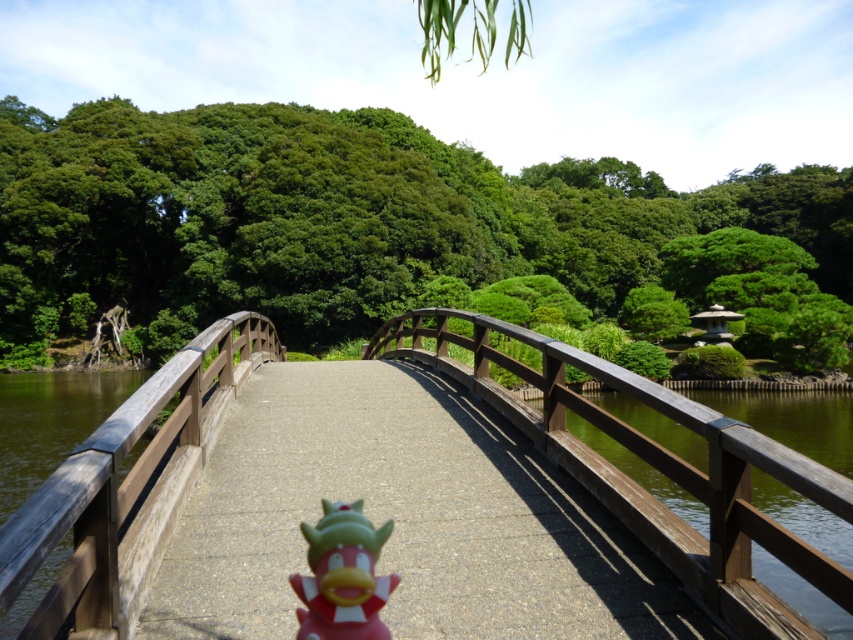
Question: Among these points, which one is farthest from the camera?

Choices:
 (A) (207, 396)
 (B) (372, 616)
 (C) (672, 552)

Answer: (A)

Question: Can you confirm if wooden bridge at center is positioned below wooden rail at center?

Choices:
 (A) yes
 (B) no

Answer: (B)

Question: Which object appears closest to the camera in this image?

Choices:
 (A) wooden rail at center
 (B) pink rubber duck at center

Answer: (A)

Question: Is wooden bridge at center wider than pink rubber duck at center?

Choices:
 (A) no
 (B) yes

Answer: (B)

Question: Does wooden bridge at center appear on the right side of wooden rail at center?

Choices:
 (A) no
 (B) yes

Answer: (B)

Question: Which object is closer to the camera taking this photo?

Choices:
 (A) pink rubber duck at center
 (B) wooden rail at center

Answer: (B)